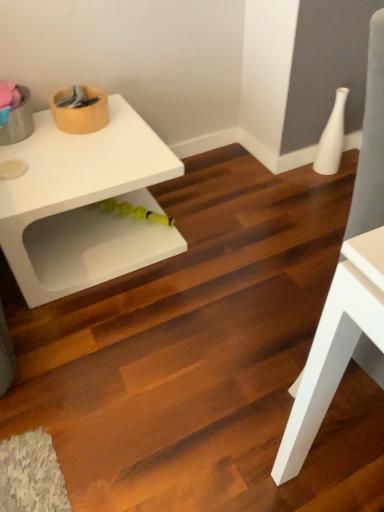
The width and height of the screenshot is (384, 512). What are the coordinates of `vacant space to the right of white matte table at upper left, which is the 1th table in left-to-right order` in the screenshot? It's located at (228, 228).